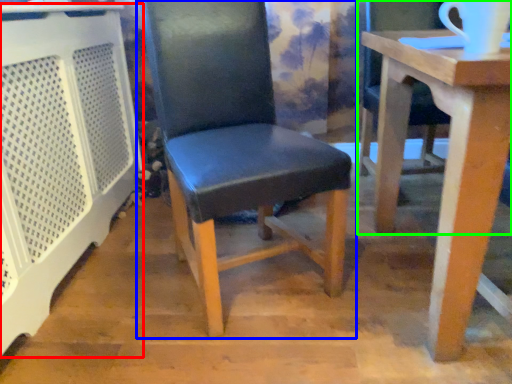
Question: Estimate the real-world distances between objects in this image. Which object is farther from cage (highlighted by a red box), chair (highlighted by a blue box) or chair (highlighted by a green box)?

Choices:
 (A) chair
 (B) chair

Answer: (B)